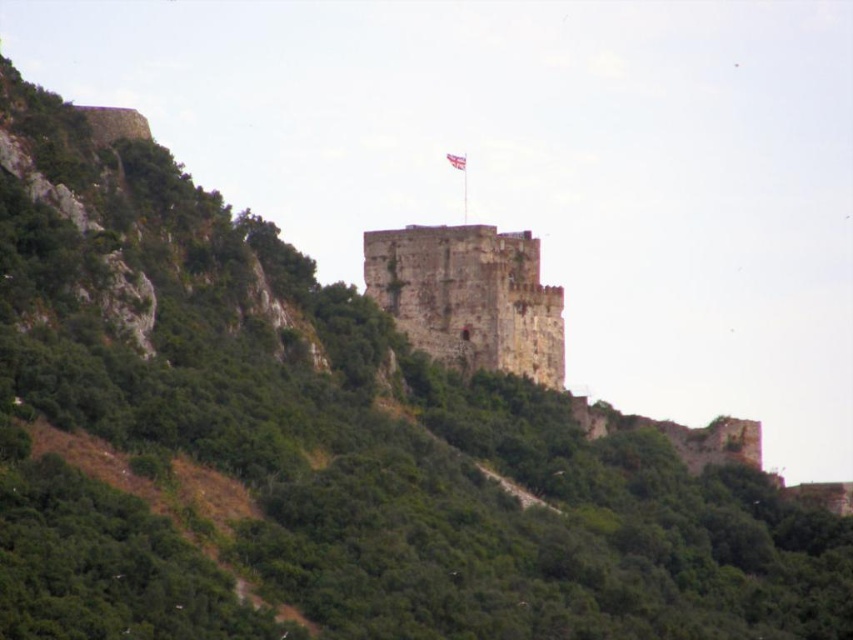
Question: Does rusty stone tower at center appear on the right side of white fabric flag at upper center?

Choices:
 (A) yes
 (B) no

Answer: (B)

Question: Is rusty stone tower at center to the left of white fabric flag at upper center from the viewer's perspective?

Choices:
 (A) yes
 (B) no

Answer: (A)

Question: Which of the following is the closest to the observer?

Choices:
 (A) (410, 236)
 (B) (461, 157)

Answer: (A)

Question: Which object is closer to the camera taking this photo?

Choices:
 (A) white fabric flag at upper center
 (B) rusty stone tower at center

Answer: (B)

Question: Is rusty stone tower at center wider than white fabric flag at upper center?

Choices:
 (A) no
 (B) yes

Answer: (B)